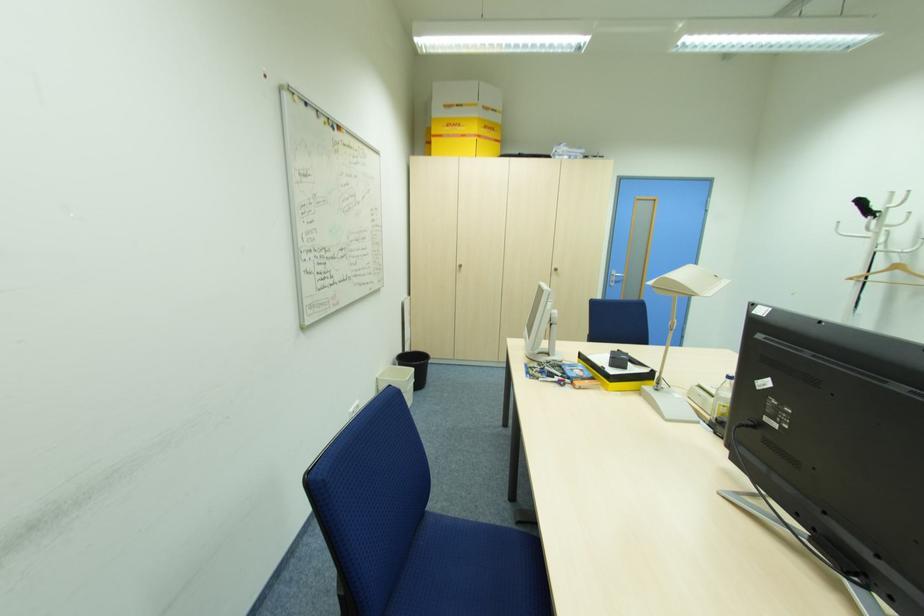
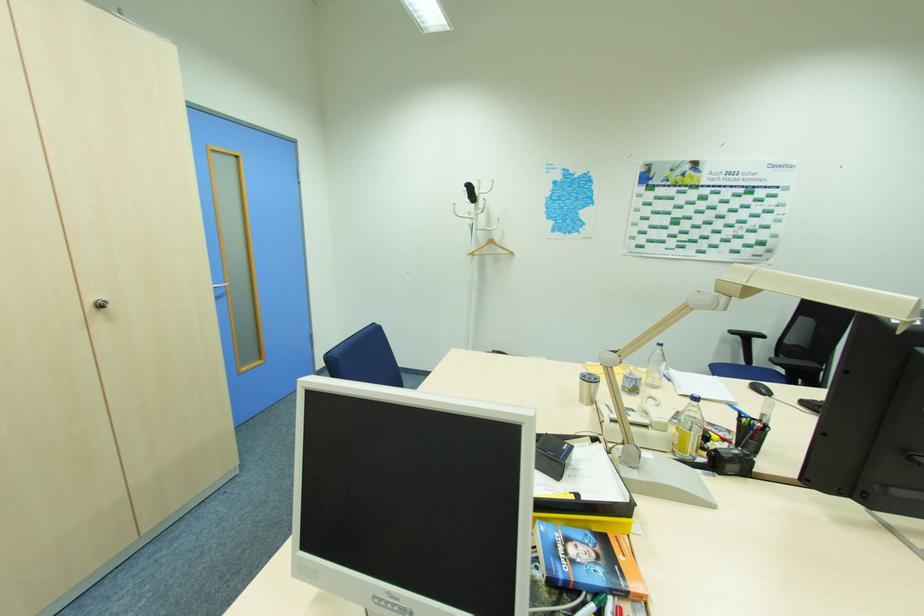
Find the pixel in the second image that matches point (558, 270) in the first image.

(103, 306)